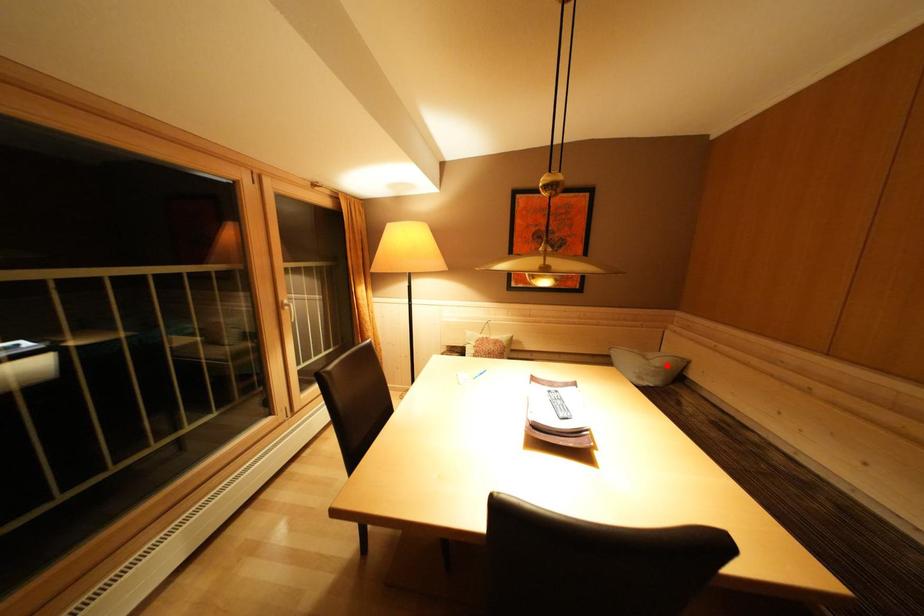
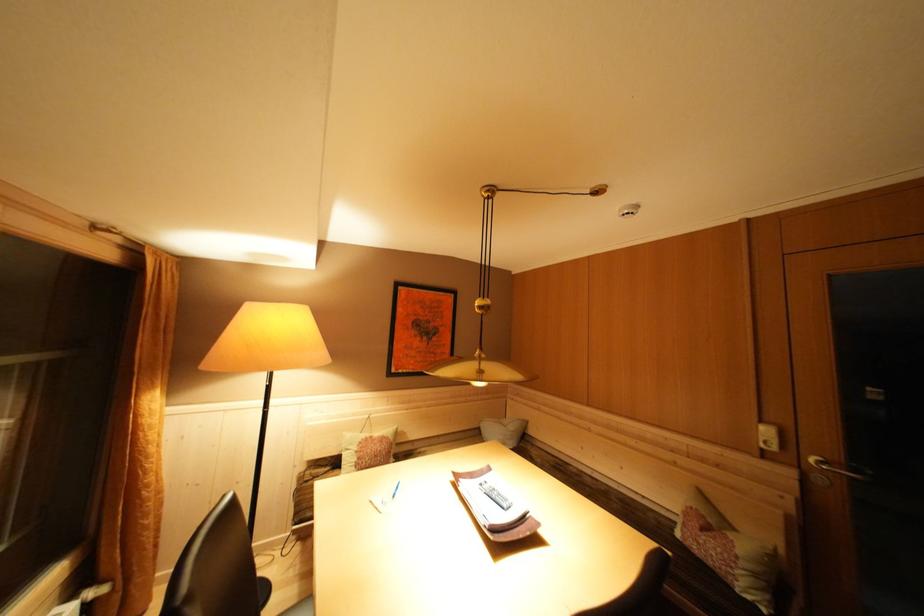
Question: I am providing you with two images of the same scene from different viewpoints. In image1, a red point is highlighted. Considering the same 3D point in image2, which of the following is correct?

Choices:
 (A) It is closer
 (B) It is farther

Answer: (B)